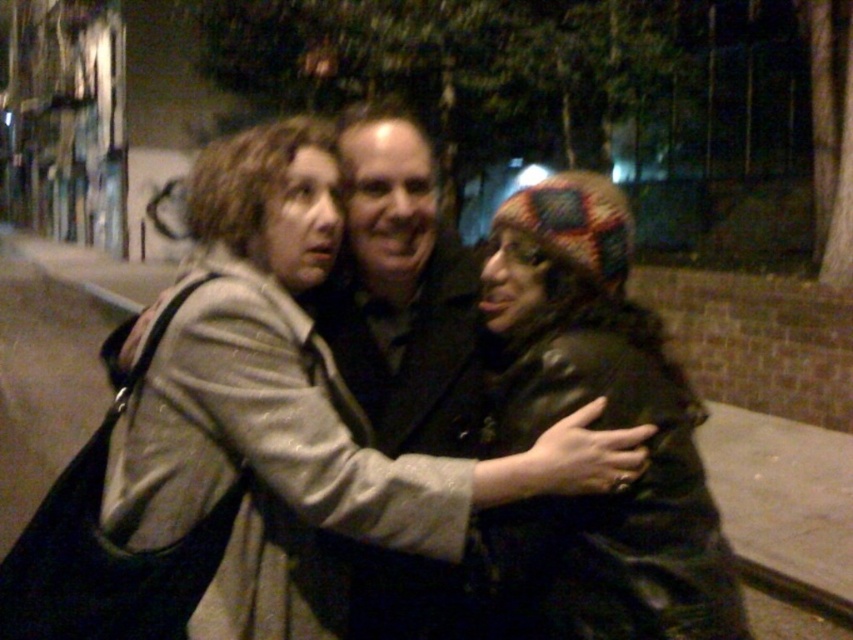
Question: Which is nearer to the matte gray coat at center?

Choices:
 (A) black matte jacket at center
 (B) knitted multicolor hat at center

Answer: (B)

Question: Estimate the real-world distances between objects in this image. Which object is closer to the matte gray coat at center?

Choices:
 (A) black matte jacket at center
 (B) knitted multicolor hat at center

Answer: (B)

Question: Is matte gray coat at center positioned behind knitted multicolor hat at center?

Choices:
 (A) yes
 (B) no

Answer: (B)

Question: Which object is positioned farthest from the matte gray coat at center?

Choices:
 (A) black matte jacket at center
 (B) knitted multicolor hat at center

Answer: (A)

Question: Does matte gray coat at center lie in front of black matte jacket at center?

Choices:
 (A) no
 (B) yes

Answer: (B)

Question: Can you confirm if matte gray coat at center is thinner than knitted multicolor hat at center?

Choices:
 (A) yes
 (B) no

Answer: (B)